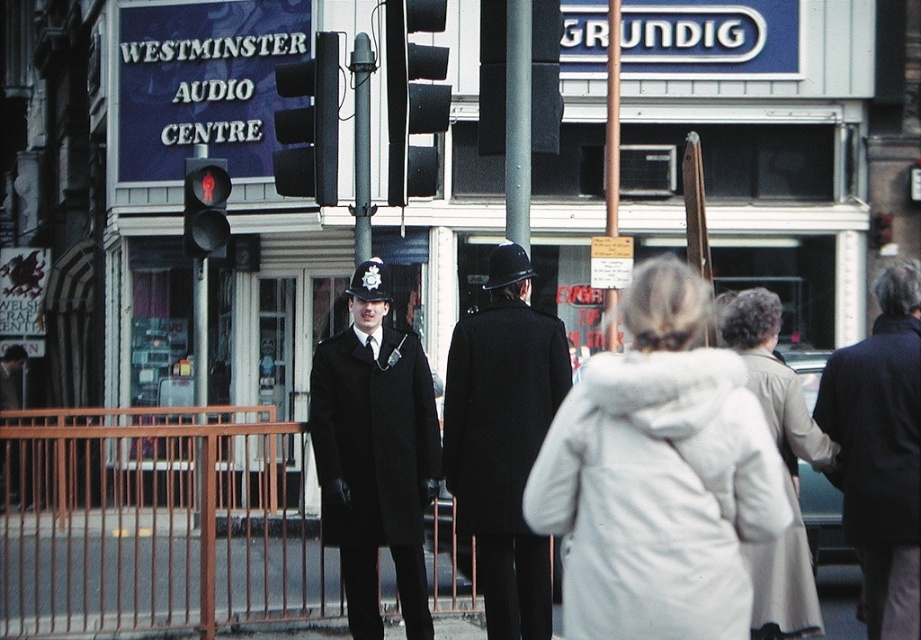
You are a pedestrian standing on the sidewalk and see the matte black uniform at center and the metallic traffic light at left. Which object is nearer to you?

The matte black uniform at center is closer to the viewer than the metallic traffic light at left, so the matte black uniform at center is nearer to you.

In the scene shown: You are a photographer trying to capture both the matte black uniform at center and the metallic traffic light at left in a single frame. Based on their sizes in the image, which object will appear smaller in your photo?

The matte black uniform at center appears smaller in the photo because it is thinner than the metallic traffic light at left.